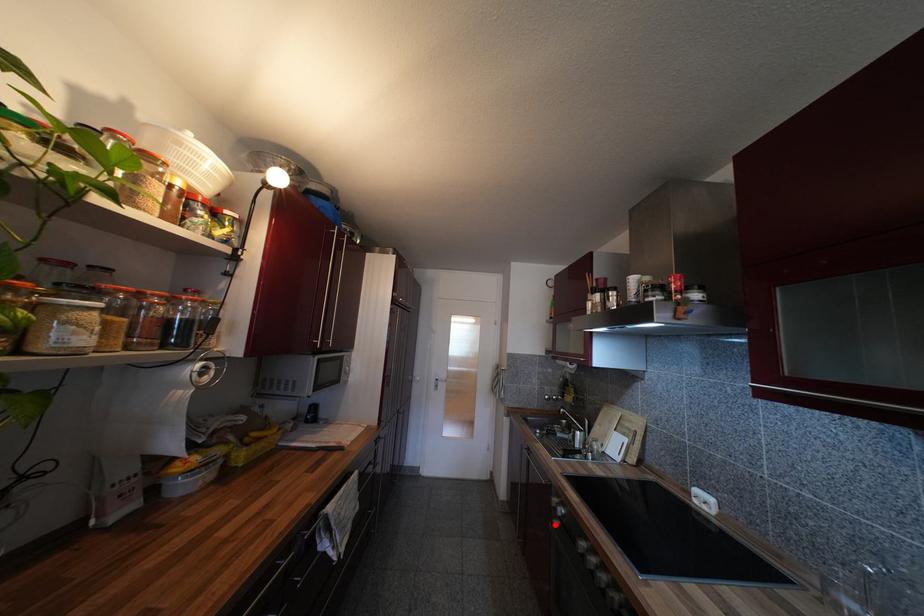
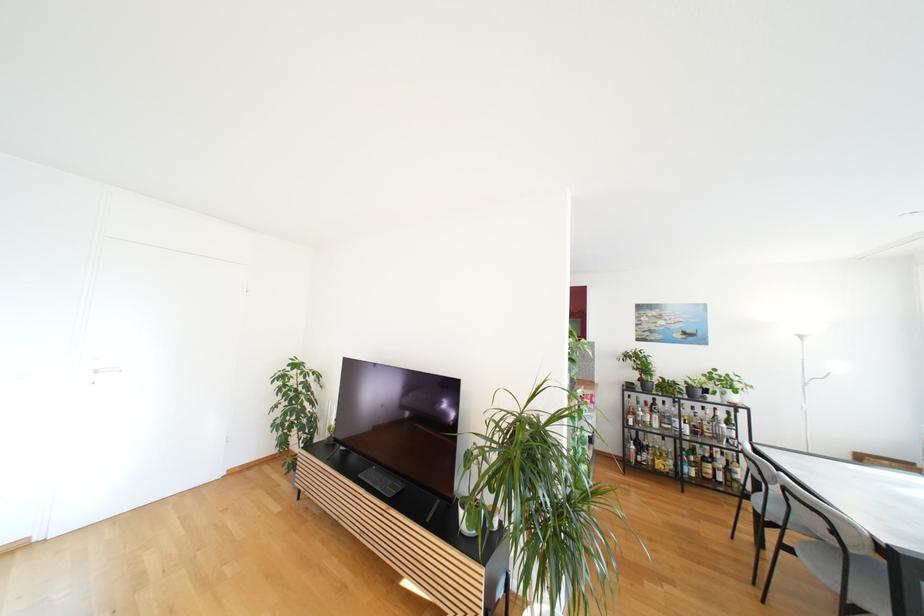
Question: I am providing you with two images of the same scene from different viewpoints. A red point is marked on the first image. Is the red point's position out of view in image 2?

Choices:
 (A) Yes
 (B) No

Answer: (A)